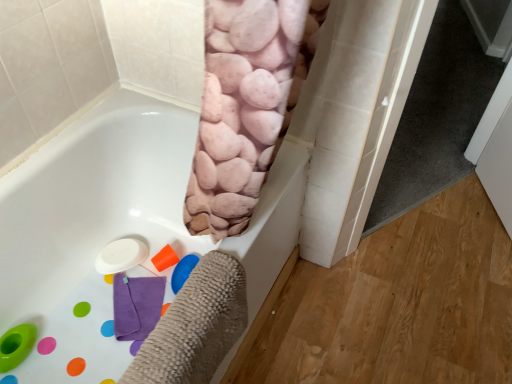
Question: Is white matte bathtub at center positioned in front of white glossy screen door at right?

Choices:
 (A) no
 (B) yes

Answer: (B)

Question: Is white matte bathtub at center aimed at white glossy screen door at right?

Choices:
 (A) no
 (B) yes

Answer: (A)

Question: Considering the relative sizes of white matte bathtub at center and white glossy screen door at right in the image provided, is white matte bathtub at center shorter than white glossy screen door at right?

Choices:
 (A) no
 (B) yes

Answer: (B)

Question: Can you confirm if white matte bathtub at center is wider than white glossy screen door at right?

Choices:
 (A) no
 (B) yes

Answer: (B)

Question: Is white matte bathtub at center bigger than white glossy screen door at right?

Choices:
 (A) no
 (B) yes

Answer: (B)

Question: Are white matte bathtub at center and white glossy screen door at right far apart?

Choices:
 (A) no
 (B) yes

Answer: (B)

Question: Is white glossy screen door at right positioned with its back to white matte bathtub at center?

Choices:
 (A) yes
 (B) no

Answer: (B)

Question: From the image's perspective, is white glossy screen door at right on white matte bathtub at center?

Choices:
 (A) no
 (B) yes

Answer: (B)

Question: Is white glossy screen door at right taller than white matte bathtub at center?

Choices:
 (A) no
 (B) yes

Answer: (B)

Question: From a real-world perspective, is white glossy screen door at right on white matte bathtub at center?

Choices:
 (A) yes
 (B) no

Answer: (A)

Question: Can you confirm if white glossy screen door at right is thinner than white matte bathtub at center?

Choices:
 (A) no
 (B) yes

Answer: (B)

Question: Can you confirm if white glossy screen door at right is smaller than white matte bathtub at center?

Choices:
 (A) yes
 (B) no

Answer: (A)

Question: Looking at their shapes, would you say white matte bathtub at center is wider or thinner than white glossy screen door at right?

Choices:
 (A) thin
 (B) wide

Answer: (B)